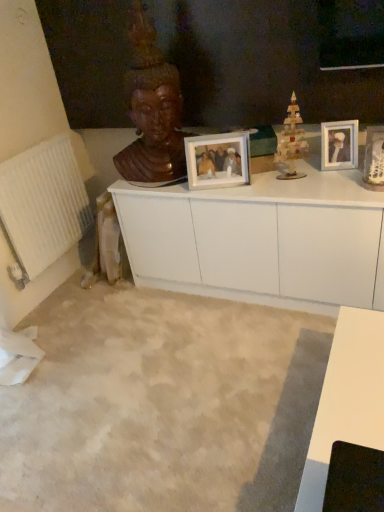
The height and width of the screenshot is (512, 384). What are the coordinates of `white glossy cabinet at center` in the screenshot? It's located at (261, 240).

Find the location of a particular element. white textured radiator at left is located at coordinates (42, 206).

From the image's perspective, which object appears higher, white glossy cabinet at center or white glossy picture frame at upper right, the 2th picture frame from the left?

From the image's view, white glossy picture frame at upper right, the 2th picture frame from the left, is above.

Is white glossy cabinet at center looking in the opposite direction of white glossy picture frame at upper right, the 2th picture frame from the left?

white glossy cabinet at center does not have its back to white glossy picture frame at upper right, the 2th picture frame from the left.

Is white glossy cabinet at center further to camera compared to white glossy picture frame at upper right, the 1th picture frame from the right?

No, white glossy cabinet at center is closer to the camera.

Between white glossy cabinet at center and white glossy picture frame at upper right, the 1th picture frame from the right, which one appears on the right side from the viewer's perspective?

white glossy picture frame at upper right, the 1th picture frame from the right, is more to the right.

Can you confirm if matte white picture frame at center, the 2th picture frame in the right-to-left sequence, is wider than white glossy picture frame at upper right, the 1th picture frame from the right?

Correct, the width of matte white picture frame at center, the 2th picture frame in the right-to-left sequence, exceeds that of white glossy picture frame at upper right, the 1th picture frame from the right.

Who is taller, matte white picture frame at center, the 2th picture frame in the right-to-left sequence, or white glossy picture frame at upper right, the 2th picture frame from the left?

Standing taller between the two is matte white picture frame at center, the 2th picture frame in the right-to-left sequence.

Consider the image. From a real-world perspective, between matte white picture frame at center, the 2th picture frame in the right-to-left sequence, and white glossy picture frame at upper right, the 2th picture frame from the left, who is vertically lower?

From a 3D spatial view, white glossy picture frame at upper right, the 2th picture frame from the left, is below.

Is matte white picture frame at center, which is the 1th picture frame from left to right, in front of or behind white glossy picture frame at upper right, the 2th picture frame from the left, in the image?

Clearly, matte white picture frame at center, which is the 1th picture frame from left to right, is in front of white glossy picture frame at upper right, the 2th picture frame from the left.

Is white glossy cabinet at center not inside wooden statue at upper center?

white glossy cabinet at center is positioned outside wooden statue at upper center.

Would you consider white glossy cabinet at center to be distant from wooden statue at upper center?

A: No, white glossy cabinet at center is in close proximity to wooden statue at upper center.

From a real-world perspective, is white glossy cabinet at center positioned above or below wooden statue at upper center?

white glossy cabinet at center is below wooden statue at upper center.

Could you tell me if white glossy cabinet at center is facing wooden statue at upper center?

No, white glossy cabinet at center does not turn towards wooden statue at upper center.

Considering the relative sizes of matte white picture frame at center, which is the 1th picture frame from left to right, and wooden statue at upper center in the image provided, is matte white picture frame at center, which is the 1th picture frame from left to right, taller than wooden statue at upper center?

Incorrect, the height of matte white picture frame at center, which is the 1th picture frame from left to right, is not larger of that of wooden statue at upper center.

Based on their sizes in the image, would you say matte white picture frame at center, the 2th picture frame in the right-to-left sequence, is bigger or smaller than wooden statue at upper center?

In the image, matte white picture frame at center, the 2th picture frame in the right-to-left sequence, appears to be smaller than wooden statue at upper center.

Are matte white picture frame at center, which is the 1th picture frame from left to right, and wooden statue at upper center located far from each other?

→ No, there isn't a large distance between matte white picture frame at center, which is the 1th picture frame from left to right, and wooden statue at upper center.

Is matte white picture frame at center, which is the 1th picture frame from left to right, oriented away from wooden statue at upper center?

That's right, matte white picture frame at center, which is the 1th picture frame from left to right, is facing away from wooden statue at upper center.

Which of these two, white textured radiator at left or white glossy picture frame at upper right, the 2th picture frame from the left, is bigger?

Bigger between the two is white textured radiator at left.

Image resolution: width=384 pixels, height=512 pixels. I want to click on radiator below the white glossy picture frame at upper right, the 2th picture frame from the left (from a real-world perspective), so click(42, 206).

From a real-world perspective, is white textured radiator at left physically above white glossy picture frame at upper right, the 2th picture frame from the left?

No, from a real-world perspective, white textured radiator at left is not above white glossy picture frame at upper right, the 2th picture frame from the left.

Measure the distance from white textured radiator at left to white glossy picture frame at upper right, the 1th picture frame from the right.

white textured radiator at left is 4.69 feet from white glossy picture frame at upper right, the 1th picture frame from the right.

Does white glossy cabinet at center come behind wooden toy at center?

No, the depth of white glossy cabinet at center is less than that of wooden toy at center.

Is white glossy cabinet at center completely or partially outside of wooden toy at center?

Indeed, white glossy cabinet at center is completely outside wooden toy at center.

Which is closer to the camera, (266,197) or (284,159)?

Point (266,197) is positioned closer to the camera compared to point (284,159).

Does white textured radiator at left have a greater width compared to white glossy cabinet at center?

Incorrect, the width of white textured radiator at left does not surpass that of white glossy cabinet at center.

Considering the points (56, 213) and (282, 214), which point is in front, point (56, 213) or point (282, 214)?

Positioned in front is point (282, 214).

From the image's perspective, is white textured radiator at left positioned above or below white glossy cabinet at center?

From the image's perspective, white textured radiator at left appears above white glossy cabinet at center.

Is white glossy cabinet at center inside white textured radiator at left?

Definitely not — white glossy cabinet at center is not inside white textured radiator at left.

At what (x,y) coordinates should I click in order to perform the action: click on cabinetry that appears below the white glossy picture frame at upper right, the 1th picture frame from the right (from the image's perspective). Please return your answer as a coordinate pair (x, y). The height and width of the screenshot is (512, 384). Looking at the image, I should click on (261, 240).

This screenshot has height=512, width=384. Identify the location of picture frame that is in front of the white glossy picture frame at upper right, the 1th picture frame from the right. (218, 160).

When comparing their distances from white glossy picture frame at upper right, the 1th picture frame from the right, does wooden toy at center or white textured radiator at left seem further?

The object further to white glossy picture frame at upper right, the 1th picture frame from the right, is white textured radiator at left.

Which object lies nearer to the anchor point wooden statue at upper center, wooden toy at center or white textured radiator at left?

The object closer to wooden statue at upper center is wooden toy at center.

Consider the image. From the image, which object appears to be farther from white glossy picture frame at upper right, the 2th picture frame from the left, white textured radiator at left or white glossy cabinet at center?

white textured radiator at left lies further to white glossy picture frame at upper right, the 2th picture frame from the left, than the other object.

Based on the photo, when comparing their distances from wooden statue at upper center, does matte white picture frame at center, which is the 1th picture frame from left to right, or wooden toy at center seem closer?

matte white picture frame at center, which is the 1th picture frame from left to right, lies closer to wooden statue at upper center than the other object.

When comparing their distances from wooden toy at center, does white textured radiator at left or matte white picture frame at center, which is the 1th picture frame from left to right, seem further?

white textured radiator at left.

Looking at this image, considering their positions, is matte white picture frame at center, the 2th picture frame in the right-to-left sequence, positioned closer to white glossy picture frame at upper right, the 2th picture frame from the left, than white glossy cabinet at center?

matte white picture frame at center, the 2th picture frame in the right-to-left sequence, lies closer to white glossy picture frame at upper right, the 2th picture frame from the left, than the other object.

Looking at the image, which one is located further to white glossy cabinet at center, wooden statue at upper center or white textured radiator at left?

The object further to white glossy cabinet at center is white textured radiator at left.

Looking at the image, which one is located closer to white glossy cabinet at center, white textured radiator at left or matte white picture frame at center, which is the 1th picture frame from left to right?

matte white picture frame at center, which is the 1th picture frame from left to right, is closer to white glossy cabinet at center.

This screenshot has width=384, height=512. Find the location of `picture frame between white textured radiator at left and white glossy picture frame at upper right, the 2th picture frame from the left`. picture frame between white textured radiator at left and white glossy picture frame at upper right, the 2th picture frame from the left is located at coordinates (218, 160).

Find the location of a particular element. toy between wooden statue at upper center and white glossy picture frame at upper right, the 2th picture frame from the left, from left to right is located at coordinates (291, 143).

This screenshot has width=384, height=512. In order to click on picture frame situated between white textured radiator at left and wooden toy at center from left to right in this screenshot , I will do `click(218, 160)`.

Identify the location of cabinetry situated between wooden statue at upper center and white glossy picture frame at upper right, the 1th picture frame from the right, from left to right. (261, 240).